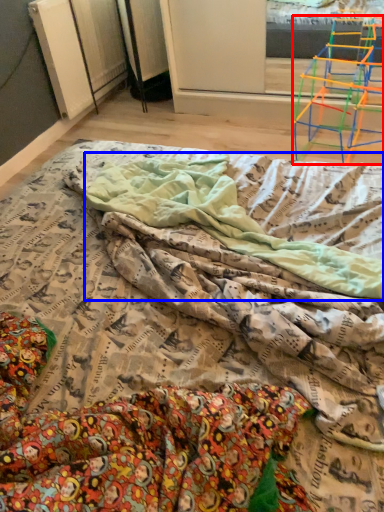
Question: Which object appears farthest to the camera in this image, furniture (highlighted by a red box) or blanket (highlighted by a blue box)?

Choices:
 (A) furniture
 (B) blanket

Answer: (A)